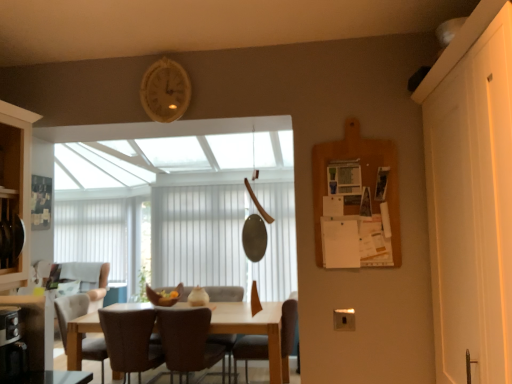
What do you see at coordinates (225, 293) in the screenshot? I see `brown leather chair at center, which is the third chair in left-to-right order` at bounding box center [225, 293].

The height and width of the screenshot is (384, 512). Describe the element at coordinates (356, 202) in the screenshot. I see `wooden bulletin board at right` at that location.

The image size is (512, 384). I want to click on wooden bulletin board at right, so click(x=356, y=202).

This screenshot has width=512, height=384. Describe the element at coordinates (130, 341) in the screenshot. I see `brown leather chair at center, which is counted as the 3th chair, starting from the right` at that location.

Locate an element on the screen. The image size is (512, 384). brown leather chair at center, which appears as the fourth chair when viewed from the left is located at coordinates (250, 351).

Measure the distance between point (489, 152) and camera.

Point (489, 152) is 1.17 meters away from camera.

This screenshot has width=512, height=384. I want to click on wooden clock at upper center, so click(165, 91).

Identify the location of brown leather chair at center, acting as the 2th chair starting from the right. (225, 293).

From a real-world perspective, is brown leather chair at lower left, which is counted as the 4th chair, starting from the right, physically below brown leather chair at center, which appears as the fourth chair when viewed from the left?

No, from a real-world perspective, brown leather chair at lower left, which is counted as the 4th chair, starting from the right, is not beneath brown leather chair at center, which appears as the fourth chair when viewed from the left.

Can you see brown leather chair at lower left, the first chair positioned from the left, touching brown leather chair at center, which appears as the fourth chair when viewed from the left?

No, brown leather chair at lower left, the first chair positioned from the left, is not making contact with brown leather chair at center, which appears as the fourth chair when viewed from the left.

Is point (61, 320) more distant than point (245, 352)?

That is False.

Considering the sizes of brown leather chair at lower left, the first chair positioned from the left, and brown leather chair at center, the first chair positioned from the right, in the image, is brown leather chair at lower left, the first chair positioned from the left, wider or thinner than brown leather chair at center, the first chair positioned from the right,?

brown leather chair at lower left, the first chair positioned from the left, is wider than brown leather chair at center, the first chair positioned from the right.

From a real-world perspective, which object stands above the other?

brown leather armchair at center, from a real-world perspective.

Is brown leather armchair at center in contact with brown leather chair at center, which appears as the fourth chair when viewed from the left?

No, brown leather armchair at center is not next to brown leather chair at center, which appears as the fourth chair when viewed from the left.

Can you confirm if brown leather armchair at center is smaller than brown leather chair at center, the first chair positioned from the right?

Yes.

From the picture: Between wooden bulletin board at right and brown leather chair at center, which appears as the fourth chair when viewed from the left, which one has larger width?

brown leather chair at center, which appears as the fourth chair when viewed from the left.

Is brown leather chair at center, which appears as the fourth chair when viewed from the left, located within wooden bulletin board at right?

No, brown leather chair at center, which appears as the fourth chair when viewed from the left, is not a part of wooden bulletin board at right.

Is wooden bulletin board at right facing away from brown leather chair at center, which appears as the fourth chair when viewed from the left?

That's right, wooden bulletin board at right is facing away from brown leather chair at center, which appears as the fourth chair when viewed from the left.

Is wooden bulletin board at right at the back of brown leather chair at center, which is counted as the second chair, starting from the left?

brown leather chair at center, which is counted as the second chair, starting from the left, does not have its back to wooden bulletin board at right.

Which is in front, brown leather chair at center, which is counted as the second chair, starting from the left, or wooden bulletin board at right?

Positioned in front is wooden bulletin board at right.

From a real-world perspective, is brown leather chair at center, which is counted as the second chair, starting from the left, positioned above or below wooden bulletin board at right?

brown leather chair at center, which is counted as the second chair, starting from the left, is situated lower than wooden bulletin board at right in the real world.

Is white vertical blinds at center shorter than brown leather chair at center, acting as the 2th chair starting from the right?

Incorrect, the height of white vertical blinds at center does not fall short of that of brown leather chair at center, acting as the 2th chair starting from the right.

Is white vertical blinds at center located outside brown leather chair at center, acting as the 2th chair starting from the right?

Absolutely, white vertical blinds at center is external to brown leather chair at center, acting as the 2th chair starting from the right.

Is black plastic toaster at lower left wider or thinner than brown leather chair at center, which is counted as the 3th chair, starting from the right?

black plastic toaster at lower left is thinner than brown leather chair at center, which is counted as the 3th chair, starting from the right.

Considering the relative sizes of black plastic toaster at lower left and brown leather chair at center, which is counted as the second chair, starting from the left, in the image provided, is black plastic toaster at lower left bigger than brown leather chair at center, which is counted as the second chair, starting from the left,?

No.

Could you tell me if black plastic toaster at lower left is turned towards brown leather chair at center, which is counted as the second chair, starting from the left?

No, black plastic toaster at lower left does not turn towards brown leather chair at center, which is counted as the second chair, starting from the left.

Where is `appliance in front of the brown leather chair at center, which is counted as the 3th chair, starting from the right`? appliance in front of the brown leather chair at center, which is counted as the 3th chair, starting from the right is located at coordinates (11, 345).

Consider the image. Considering the sizes of objects brown leather chair at lower left, the first chair positioned from the left, and white vertical blinds at center in the image provided, who is taller, brown leather chair at lower left, the first chair positioned from the left, or white vertical blinds at center?

white vertical blinds at center is taller.

Is white vertical blinds at center inside brown leather chair at lower left, the first chair positioned from the left?

No, white vertical blinds at center is not a part of brown leather chair at lower left, the first chair positioned from the left.

Considering the sizes of brown leather chair at lower left, the first chair positioned from the left, and white vertical blinds at center in the image, is brown leather chair at lower left, the first chair positioned from the left, bigger or smaller than white vertical blinds at center?

Considering their sizes, brown leather chair at lower left, the first chair positioned from the left, takes up more space than white vertical blinds at center.

Which is more to the left, brown leather chair at lower left, which is counted as the 4th chair, starting from the right, or white vertical blinds at center?

Positioned to the left is white vertical blinds at center.

Where is `chair below the brown leather chair at lower left, which is counted as the 4th chair, starting from the right (from a real-world perspective)`? This screenshot has height=384, width=512. chair below the brown leather chair at lower left, which is counted as the 4th chair, starting from the right (from a real-world perspective) is located at coordinates (250, 351).

There is a brown leather armchair at center. Find the location of `the 1st chair above it (from the image's perspective)`. the 1st chair above it (from the image's perspective) is located at coordinates (250, 351).

Considering their positions, is brown leather chair at center, which appears as the fourth chair when viewed from the left, positioned closer to white/textured blind at center than brown leather chair at center, acting as the 2th chair starting from the right?

brown leather chair at center, acting as the 2th chair starting from the right, is positioned closer to the anchor white/textured blind at center.

Considering their positions, is wooden bulletin board at right positioned further to brown leather armchair at center than brown leather chair at center, the first chair positioned from the right?

Among the two, wooden bulletin board at right is located further to brown leather armchair at center.

When comparing their distances from white matte door at right, does brown leather chair at center, which is counted as the second chair, starting from the left, or brown leather armchair at center seem closer?

Based on the image, brown leather chair at center, which is counted as the second chair, starting from the left, appears to be nearer to white matte door at right.

Considering their positions, is white vertical blinds at center positioned further to brown leather chair at center, which is counted as the 3th chair, starting from the right, than black plastic toaster at lower left?

white vertical blinds at center lies further to brown leather chair at center, which is counted as the 3th chair, starting from the right, than the other object.

Estimate the real-world distances between objects in this image. Which object is further from brown leather armchair at center, wooden bulletin board at right or white matte door at right?

white matte door at right lies further to brown leather armchair at center than the other object.

Based on their spatial positions, is black plastic toaster at lower left or wooden clock at upper center closer to white/textured blind at center?

black plastic toaster at lower left is closer to white/textured blind at center.

When comparing their distances from brown leather chair at center, which is counted as the 3th chair, starting from the right, does white matte door at right or brown leather chair at center, which is the third chair in left-to-right order, seem further?

white matte door at right lies further to brown leather chair at center, which is counted as the 3th chair, starting from the right, than the other object.

In the scene shown: Based on their spatial positions, is brown leather chair at center, which is the third chair in left-to-right order, or white matte door at right closer to black plastic toaster at lower left?

Among the two, white matte door at right is located nearer to black plastic toaster at lower left.

The image size is (512, 384). Identify the location of clock positioned between black plastic toaster at lower left and brown leather chair at lower left, the first chair positioned from the left, from near to far. (165, 91).

At what (x,y) coordinates should I click in order to perform the action: click on armchair between brown leather chair at center, which is counted as the 3th chair, starting from the right, and white vertical blinds at center, along the z-axis. Please return your answer as a coordinate pair (x, y). Image resolution: width=512 pixels, height=384 pixels. Looking at the image, I should click on (225, 293).

You are a GUI agent. You are given a task and a screenshot of the screen. Output one action in this format:
    pyautogui.click(x=<x>, y=<y>)
    Task: Click on the blind between black plastic toaster at lower left and white vertical blinds at center along the z-axis
    The width and height of the screenshot is (512, 384).
    Given the screenshot: What is the action you would take?
    pyautogui.click(x=222, y=237)

Identify the location of armchair between black plastic toaster at lower left and white vertical blinds at center in the front-back direction. The height and width of the screenshot is (384, 512). (225, 293).